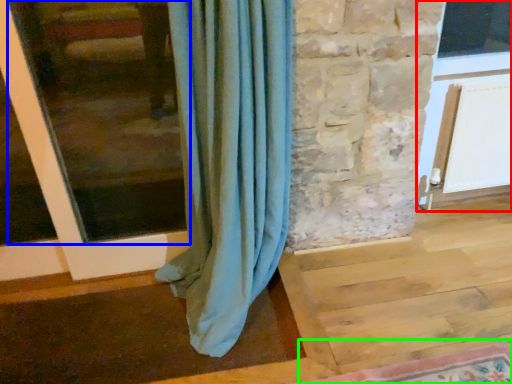
Question: Considering the real-world distances, which object is closest to screen door (highlighted by a red box)? window frame (highlighted by a blue box) or mat (highlighted by a green box).

Choices:
 (A) window frame
 (B) mat

Answer: (B)